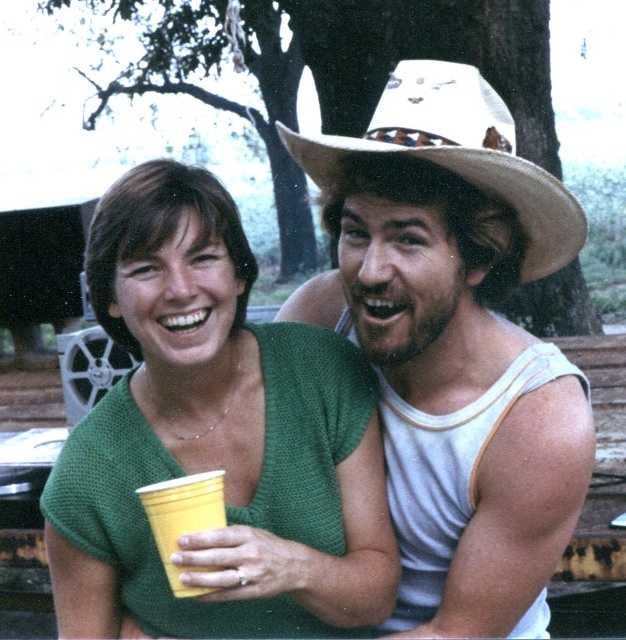
Question: From the image, what is the correct spatial relationship of green knitted shirt at center in relation to white woven cowboy hat at upper right?

Choices:
 (A) left
 (B) right

Answer: (A)

Question: Which point is farther to the camera?

Choices:
 (A) green knitted shirt at center
 (B) yellow paper cup at lower left
 (C) white woven cowboy hat at upper right
 (D) white straw cowboy hat at upper right

Answer: (D)

Question: Which point is farther to the camera?

Choices:
 (A) green knitted shirt at center
 (B) yellow paper cup at lower left
 (C) white straw cowboy hat at upper right
 (D) white woven cowboy hat at upper right

Answer: (C)

Question: In this image, where is green knitted shirt at center located relative to white straw cowboy hat at upper right?

Choices:
 (A) right
 (B) left

Answer: (B)

Question: Which object is the farthest from the yellow paper cup at lower left?

Choices:
 (A) white straw cowboy hat at upper right
 (B) green knitted shirt at center

Answer: (A)

Question: Is green knitted shirt at center further to the viewer compared to yellow paper cup at lower left?

Choices:
 (A) yes
 (B) no

Answer: (B)